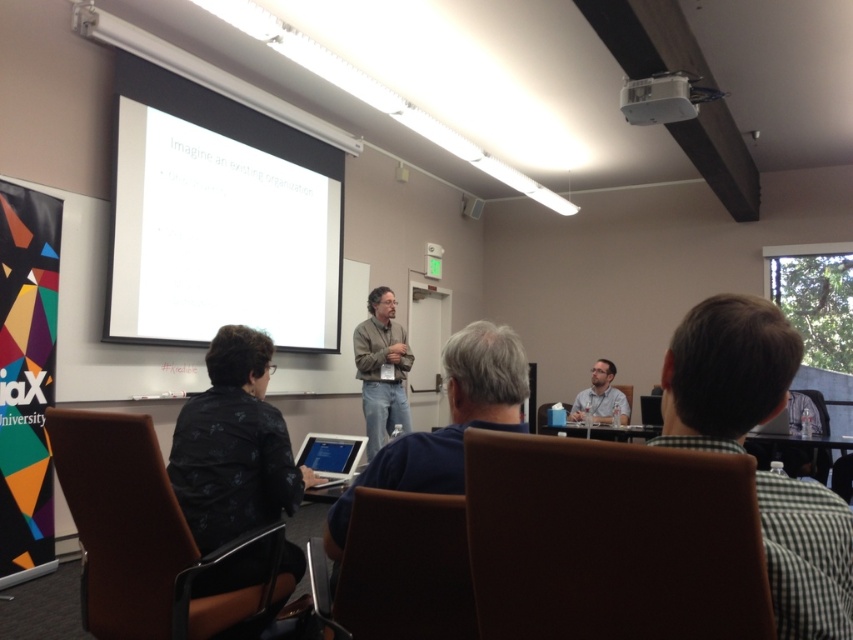
Question: Does light brown leather jacket at center have a lesser width compared to matte black laptop at center?

Choices:
 (A) yes
 (B) no

Answer: (B)

Question: Which point is closer to the camera?

Choices:
 (A) (476, 209)
 (B) (300, 221)
 (C) (753, 298)
 (D) (224, 532)

Answer: (C)

Question: Which of the following is the farthest from the observer?

Choices:
 (A) brown checkered shirt at lower right
 (B) black textured jacket at lower left
 (C) white matte projection screen at upper center

Answer: (C)

Question: Among these objects, which one is nearest to the camera?

Choices:
 (A) white plastic projector at upper center
 (B) white matte projection screen at upper center

Answer: (A)

Question: Can you confirm if brown checkered shirt at lower right is smaller than white plastic projector at upper center?

Choices:
 (A) no
 (B) yes

Answer: (B)

Question: Observing the image, what is the correct spatial positioning of black textured jacket at lower left in reference to light brown leather jacket at center?

Choices:
 (A) below
 (B) above

Answer: (A)